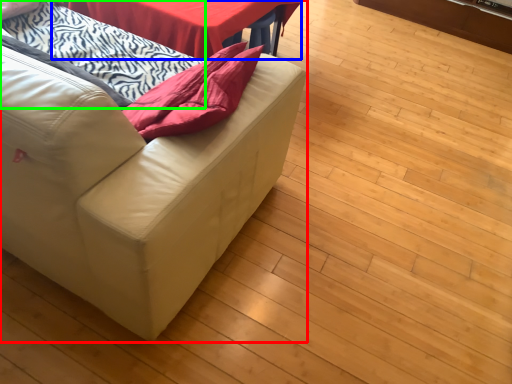
Question: Based on their relative distances, which object is nearer to studio couch (highlighted by a red box)? Choose from table (highlighted by a blue box) and blanket (highlighted by a green box).

Choices:
 (A) table
 (B) blanket

Answer: (B)